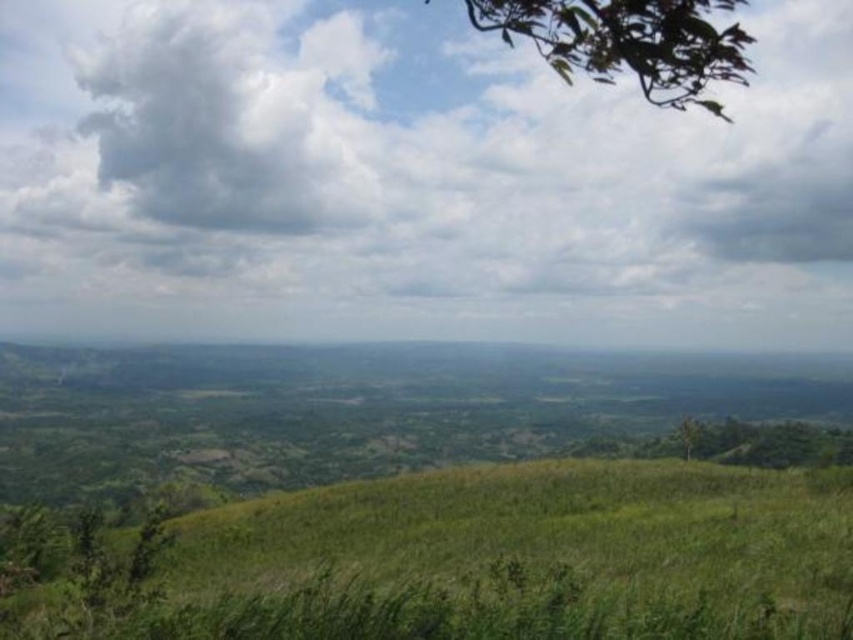
Question: Based on their relative distances, which object is nearer to the green grassy hill at lower center?

Choices:
 (A) white fluffy cloud at upper left
 (B) white fluffy cloud at upper center

Answer: (B)

Question: Does green grassy hill at lower center have a larger size compared to white fluffy cloud at upper left?

Choices:
 (A) no
 (B) yes

Answer: (A)

Question: Can you confirm if green grassy hill at lower center is positioned below white fluffy cloud at upper left?

Choices:
 (A) no
 (B) yes

Answer: (B)

Question: Does white fluffy cloud at upper center appear on the left side of white fluffy cloud at upper left?

Choices:
 (A) yes
 (B) no

Answer: (B)

Question: Which of the following is the farthest from the observer?

Choices:
 (A) (180, 51)
 (B) (846, 595)
 (C) (167, 4)

Answer: (C)

Question: Which point is closer to the camera taking this photo?

Choices:
 (A) (50, 605)
 (B) (204, 13)
 (C) (508, 129)

Answer: (A)